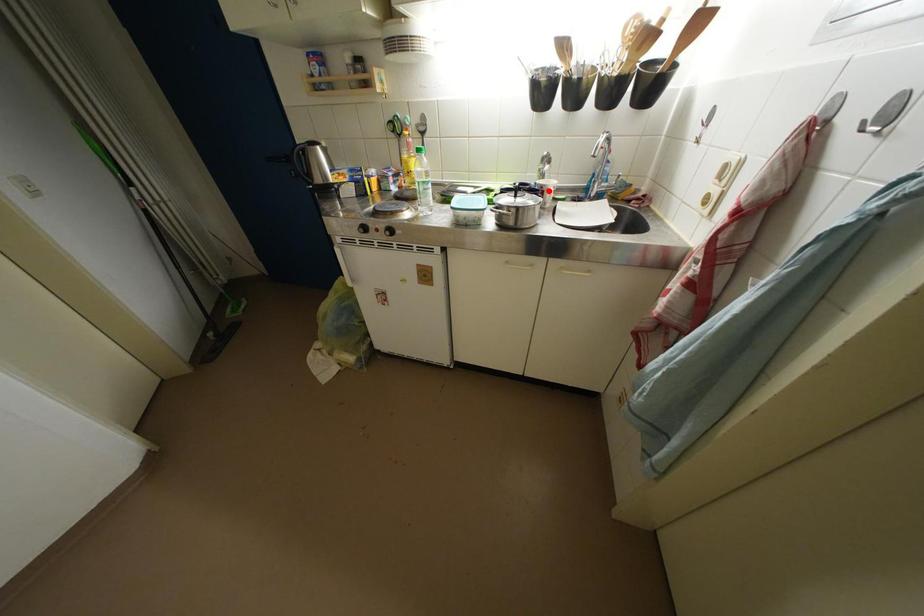
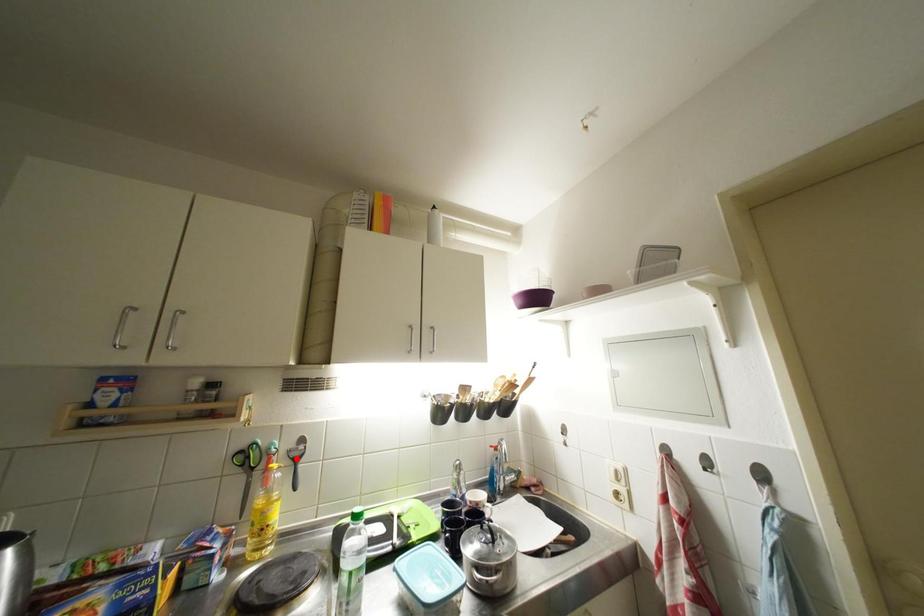
I am providing you with two images of the same scene from different viewpoints. A red point is marked on the first image and another point is marked on the second image. Do the highlighted points in image1 and image2 indicate the same real-world spot?

No